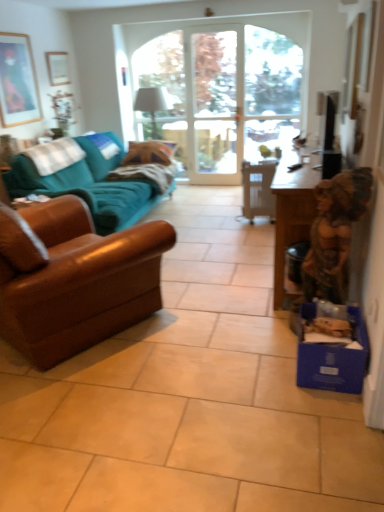
Question: Does wooden table at right have a greater height compared to clear glass door at center?

Choices:
 (A) no
 (B) yes

Answer: (A)

Question: Is the depth of wooden table at right greater than that of clear glass door at center?

Choices:
 (A) yes
 (B) no

Answer: (B)

Question: From the image's perspective, is wooden table at right located above clear glass door at center?

Choices:
 (A) yes
 (B) no

Answer: (B)

Question: Considering the relative sizes of wooden table at right and clear glass door at center in the image provided, is wooden table at right wider than clear glass door at center?

Choices:
 (A) yes
 (B) no

Answer: (A)

Question: Can you confirm if wooden table at right is thinner than clear glass door at center?

Choices:
 (A) yes
 (B) no

Answer: (B)

Question: Could you tell me if wooden table at right is turned towards clear glass door at center?

Choices:
 (A) yes
 (B) no

Answer: (B)

Question: Considering the relative positions of teal fabric couch at left, which is the 1th studio couch in back-to-front order, and wooden table at right in the image provided, is teal fabric couch at left, which is the 1th studio couch in back-to-front order, in front of wooden table at right?

Choices:
 (A) yes
 (B) no

Answer: (B)

Question: From a real-world perspective, is teal fabric couch at left, which is the 1th studio couch in back-to-front order, physically below wooden table at right?

Choices:
 (A) no
 (B) yes

Answer: (A)

Question: From a real-world perspective, is teal fabric couch at left, which is the 1th studio couch in back-to-front order, over wooden table at right?

Choices:
 (A) yes
 (B) no

Answer: (A)

Question: Is teal fabric couch at left, which ranks as the 2th studio couch in front-to-back order, wider than wooden table at right?

Choices:
 (A) no
 (B) yes

Answer: (B)

Question: From the image's perspective, does teal fabric couch at left, which ranks as the 2th studio couch in front-to-back order, appear higher than wooden table at right?

Choices:
 (A) no
 (B) yes

Answer: (B)

Question: Is clear glass door at center wider than white plastic chair at center?

Choices:
 (A) no
 (B) yes

Answer: (A)